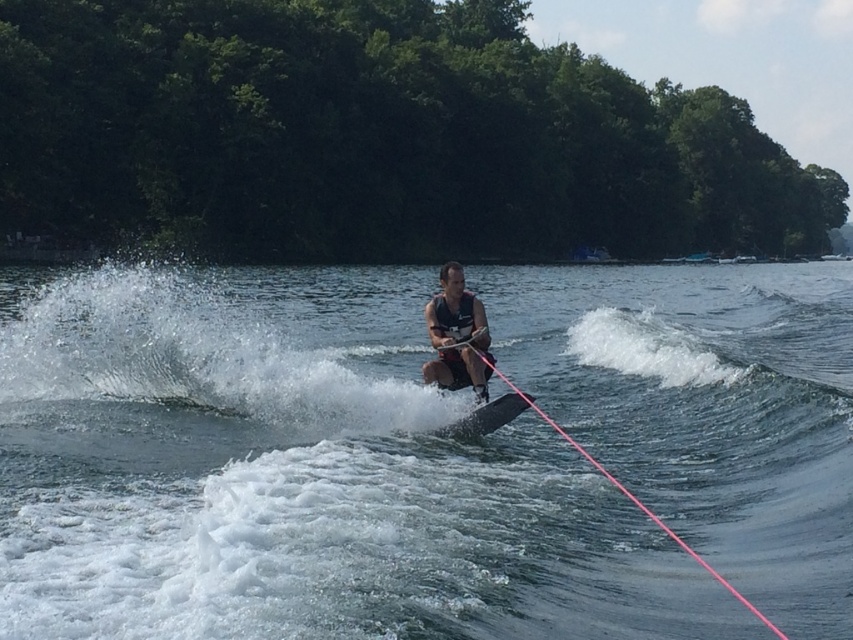
You are a safety inspector checking the water skiing setup. You notice the black matte water ski at center and the black fabric life jacket at center. According to safety guidelines, the life jacket should always be positioned above the water ski. Is this setup compliant with the guidelines?

The black matte water ski at center is below black fabric life jacket at center, so the setup is compliant with the guidelines as the life jacket is positioned above the water ski.